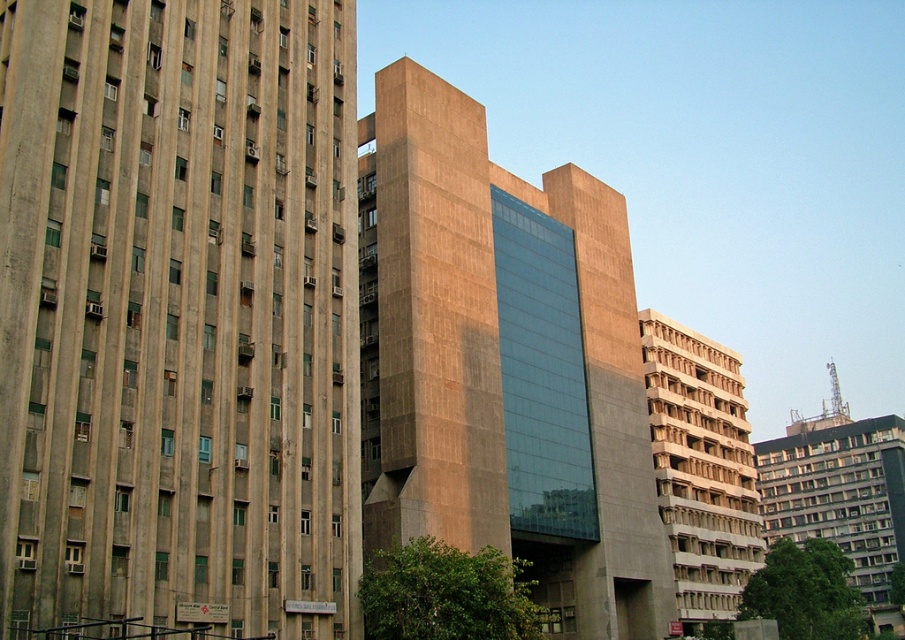
You are an architect analyzing the cityscape. You notice the concrete building at left and the white textured building at center. Which one is positioned higher in the image?

The concrete building at left is positioned higher in the image than the white textured building at center.

You are standing in the cityscape scene and want to take a photo. There are two points marked in the image, point 1 at coordinates point (x=153, y=212) and point 2 at coordinates point (x=546, y=568). Which point is closer to your camera when taking the photo?

Point (x=153, y=212) is closer to the camera than point (x=546, y=568).

You are a city planner analyzing the architectural features of the buildings in the image. Based on the coordinates provided, which building is located at point (503, 364)?

The point (503, 364) indicates the location of the matte concrete building at center.